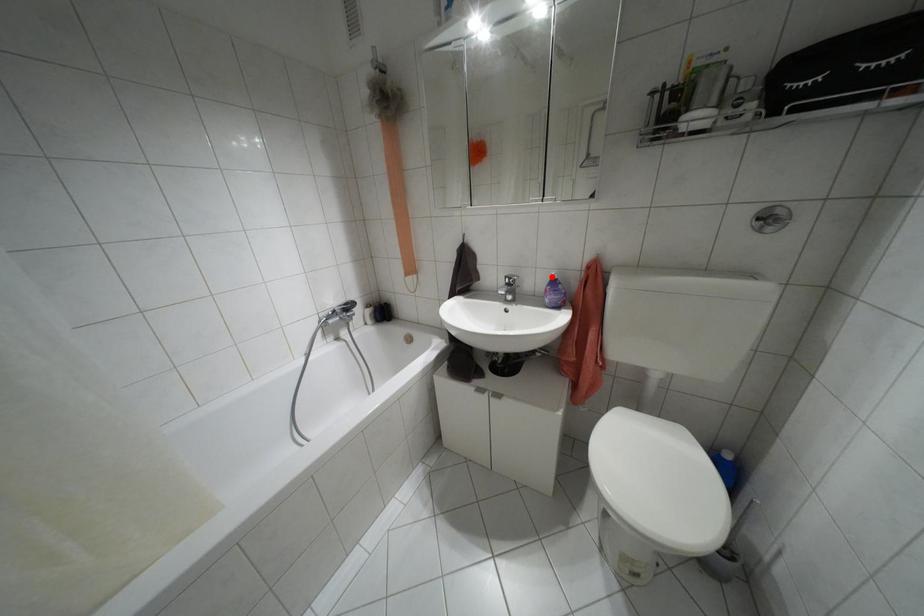
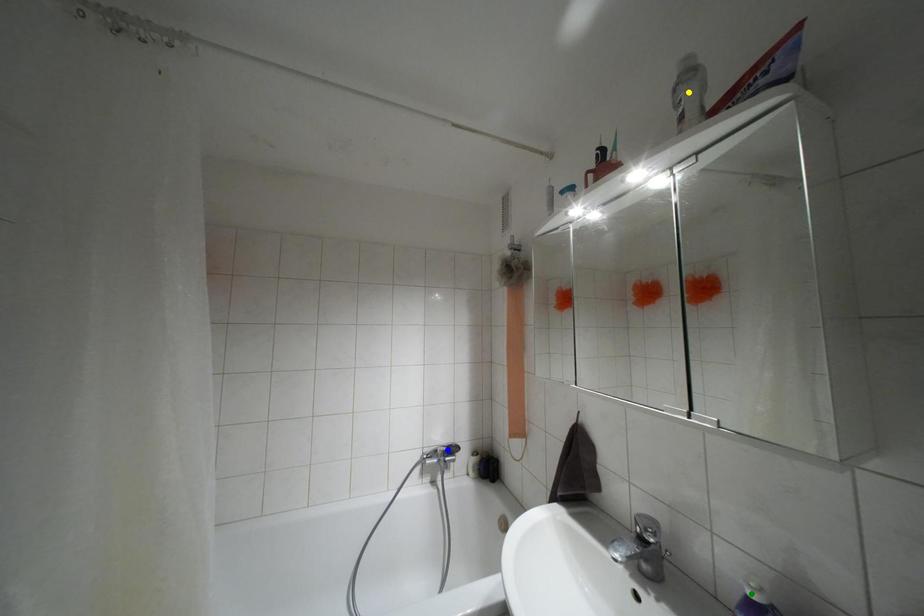
Question: I am providing you with two images of the same scene from different viewpoints. A red point is marked on the first image. You are given multiple points on the second image. Which point in image 2 is actually the same real-world point as the red point in image 1?

Choices:
 (A) blue point
 (B) yellow point
 (C) green point

Answer: (C)